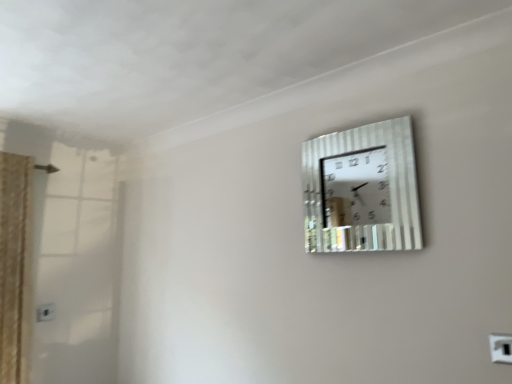
Question: In terms of width, does white plastic electric outlet at upper right, which is the first electric outlet in front-to-back order, look wider or thinner when compared to white plastic electric outlet at lower left, which ranks as the 2th electric outlet in top-to-bottom order?

Choices:
 (A) wide
 (B) thin

Answer: (A)

Question: From a real-world perspective, is white plastic electric outlet at upper right, which is the first electric outlet in front-to-back order, above or below white plastic electric outlet at lower left, the first electric outlet when ordered from back to front?

Choices:
 (A) above
 (B) below

Answer: (B)

Question: Which is nearer to the metallic silver wall clock at upper right?

Choices:
 (A) white plastic electric outlet at lower left, the 2th electric outlet viewed from the front
 (B) white plastic electric outlet at upper right, which appears as the 2th electric outlet when viewed from the left

Answer: (B)

Question: Which of these objects is positioned closest to the white plastic electric outlet at lower left, the first electric outlet when ordered from back to front?

Choices:
 (A) white plastic electric outlet at upper right, marked as the 2th electric outlet in a bottom-to-top arrangement
 (B) metallic silver wall clock at upper right

Answer: (B)